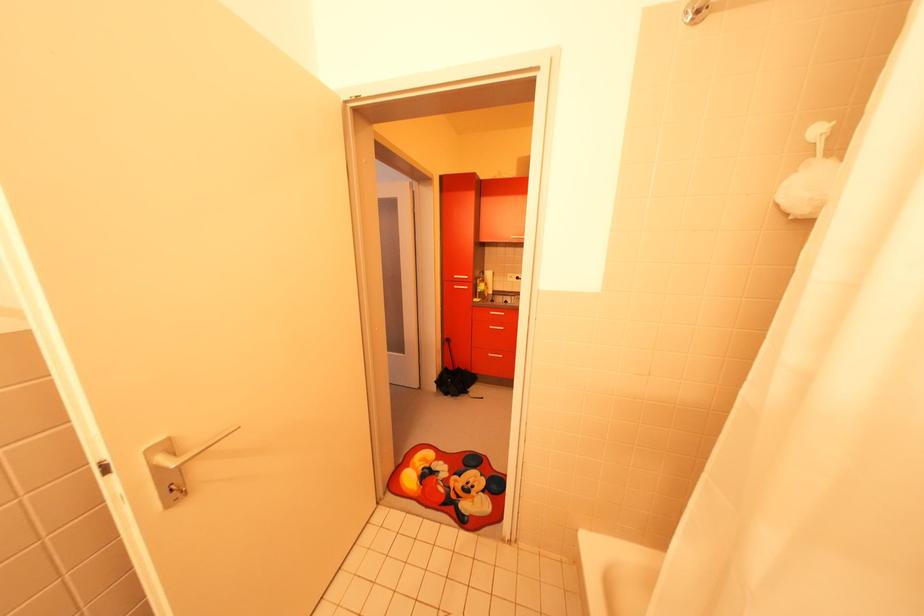
Which object does [480,286] point to?

It corresponds to the yellow bottle in the image.